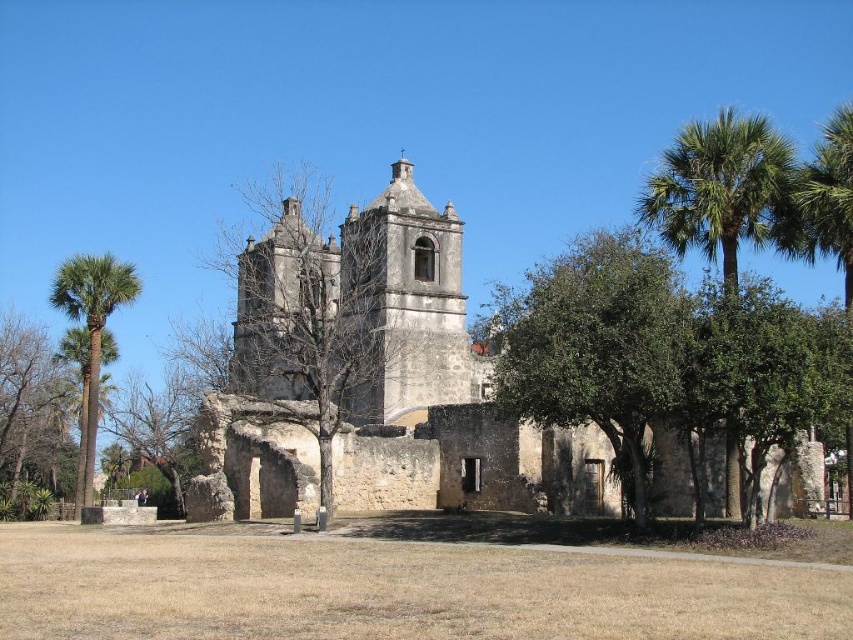
Is brown stone church at center to the right of brown rough stone tower at center from the viewer's perspective?

Correct, you'll find brown stone church at center to the right of brown rough stone tower at center.

Does brown stone church at center lie in front of brown rough stone tower at center?

Yes.

Which is behind, point (292, 275) or point (334, 262)?

Positioned behind is point (334, 262).

Image resolution: width=853 pixels, height=640 pixels. What are the coordinates of `brown stone church at center` in the screenshot? It's located at (x=364, y=308).

Does green leafy palm tree at right have a lesser width compared to green leafy palm at left?

Correct, green leafy palm tree at right's width is less than green leafy palm at left's.

Can you confirm if green leafy palm tree at right is wider than green leafy palm at left?

A: Incorrect, green leafy palm tree at right's width does not surpass green leafy palm at left's.

Which is behind, point (785, 176) or point (96, 348)?

The point (96, 348) is behind.

This screenshot has height=640, width=853. Identify the location of green leafy palm tree at right. (717, 186).

Where is `brown stone church at center`? Image resolution: width=853 pixels, height=640 pixels. brown stone church at center is located at coordinates (364, 308).

Who is lower down, brown stone church at center or green leafy palm at left?

green leafy palm at left is below.

The image size is (853, 640). Find the location of `brown stone church at center`. brown stone church at center is located at coordinates (364, 308).

The width and height of the screenshot is (853, 640). I want to click on brown stone church at center, so click(364, 308).